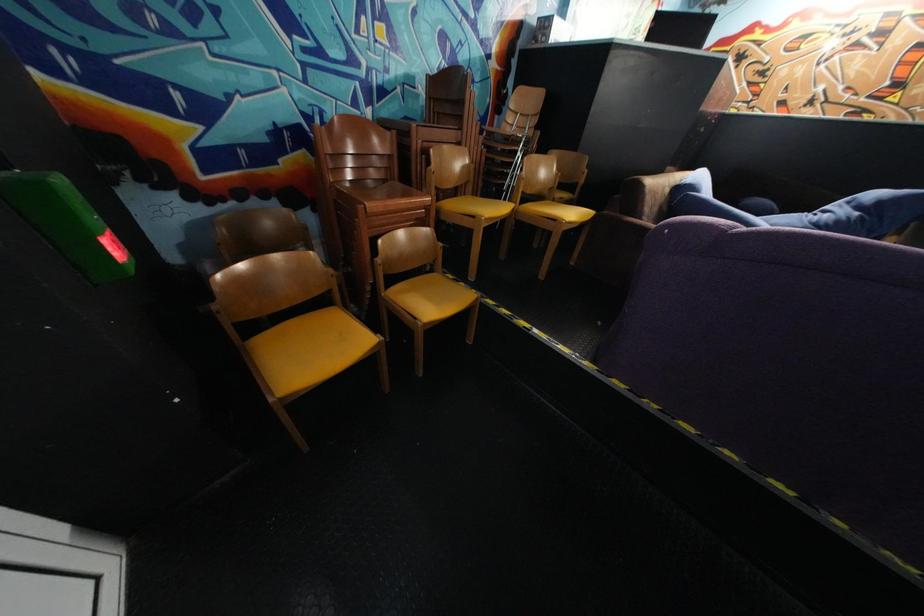
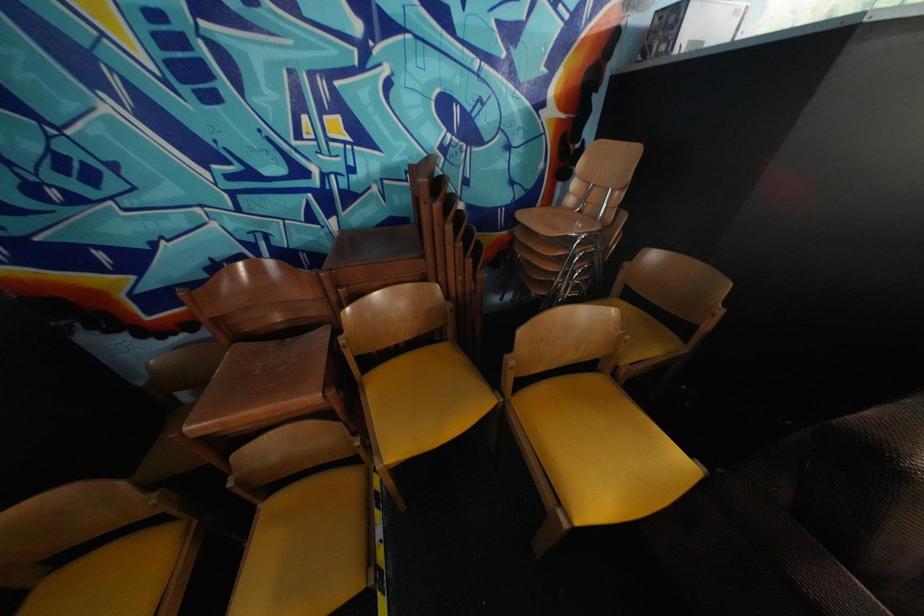
Which direction would the cameraman need to move to produce the second image?

The cameraman moved toward right, forward.